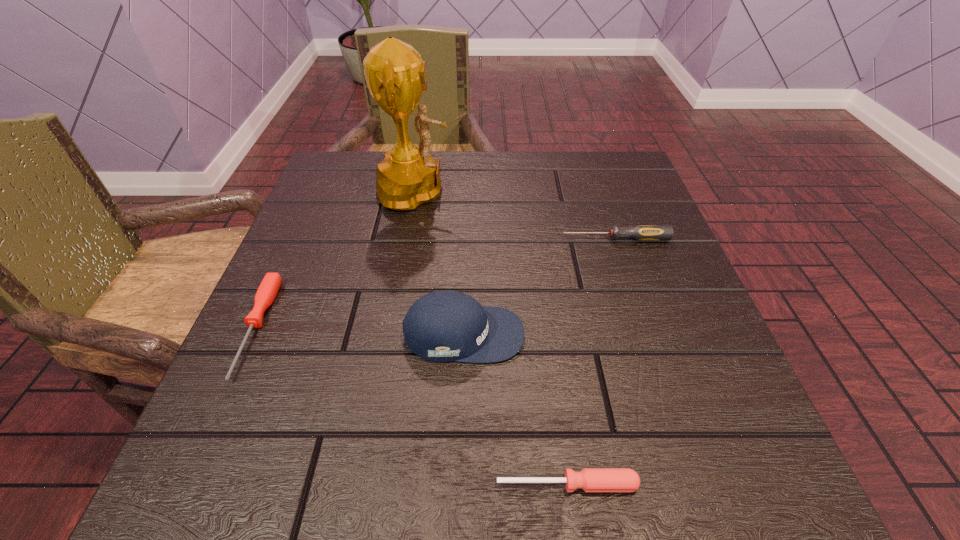
Identify the location of unoccupied position between the farthest object and the baseball cap. This screenshot has height=540, width=960. (444, 263).

This screenshot has width=960, height=540. Find the location of `vacant space that is in between the farthest object and the second farthest object`. vacant space that is in between the farthest object and the second farthest object is located at coordinates (519, 215).

Locate an element on the screen. The width and height of the screenshot is (960, 540). free space between the nearest object and the leftmost screwdriver is located at coordinates (412, 406).

Identify the location of free spot between the farthest object and the second farthest screwdriver. The height and width of the screenshot is (540, 960). (339, 259).

Where is `unoccupied position between the nearest screwdriver and the farthest screwdriver`? unoccupied position between the nearest screwdriver and the farthest screwdriver is located at coordinates (591, 361).

Locate which object ranks second in proximity to the nearest screwdriver. Please provide its 2D coordinates. Your answer should be formatted as a tuple, i.e. [(x, y)], where the tuple contains the x and y coordinates of a point satisfying the conditions above.

[(269, 287)]

I want to click on object that stands as the fourth closest to the award, so click(x=589, y=479).

Locate which screwdriver ranks in proximity to the tallest object. Please provide its 2D coordinates. Your answer should be formatted as a tuple, i.e. [(x, y)], where the tuple contains the x and y coordinates of a point satisfying the conditions above.

[(642, 233)]

Point out which screwdriver is positioned as the nearest to the nearest object. Please provide its 2D coordinates. Your answer should be formatted as a tuple, i.e. [(x, y)], where the tuple contains the x and y coordinates of a point satisfying the conditions above.

[(269, 287)]

Locate an element on the screen. The width and height of the screenshot is (960, 540). vacant area that satisfies the following two spatial constraints: 1. on the front-facing side of the fourth shortest object; 2. on the left side of the nearest screwdriver is located at coordinates (459, 484).